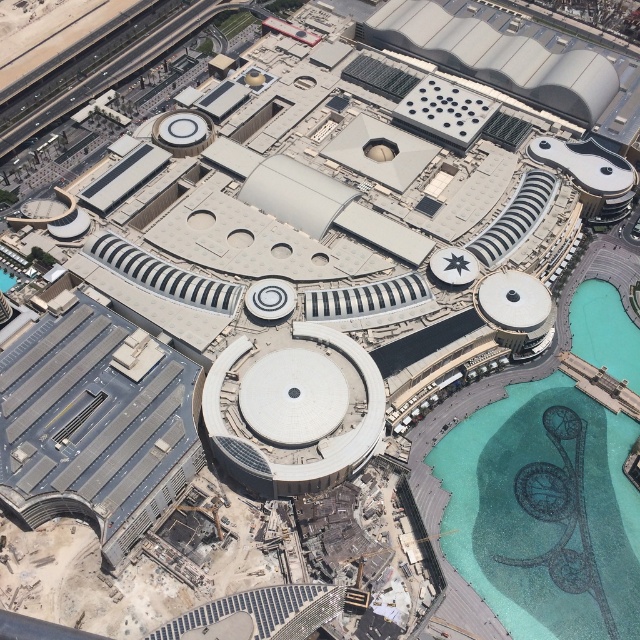
Question: Observing the image, what is the correct spatial positioning of turquoise mosaic pool at bottom right in reference to white matte dome at center?

Choices:
 (A) left
 (B) right

Answer: (B)

Question: Among these points, which one is farthest from the camera?

Choices:
 (A) (538, 301)
 (B) (608, 467)

Answer: (A)

Question: Which point is closer to the camera?

Choices:
 (A) white matte dome at center
 (B) turquoise mosaic pool at bottom right

Answer: (B)

Question: Can you confirm if turquoise mosaic pool at bottom right is wider than white matte dome at center?

Choices:
 (A) no
 (B) yes

Answer: (B)

Question: Is turquoise mosaic pool at bottom right thinner than white matte dome at center?

Choices:
 (A) no
 (B) yes

Answer: (A)